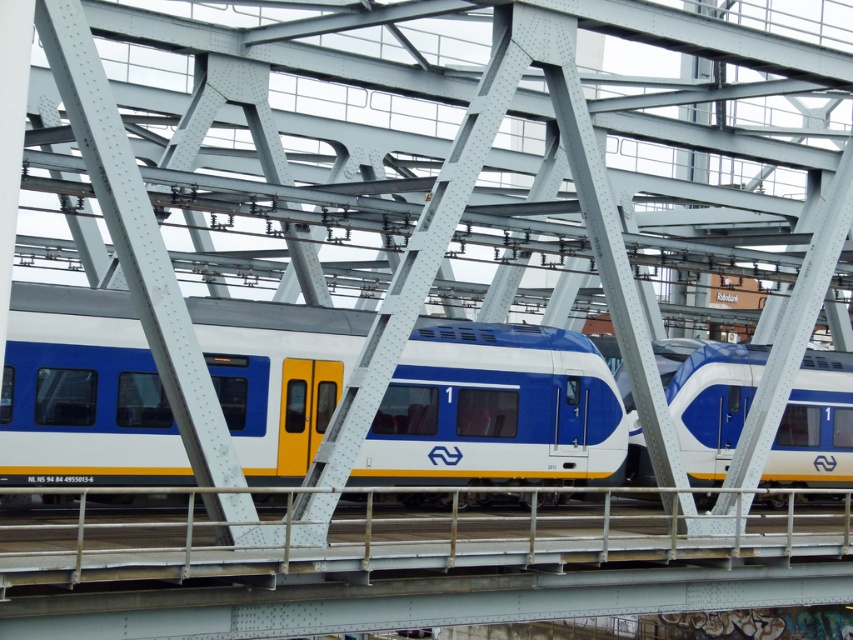
Which is more to the right, matte blue and white train at center or blue glossy train at center?

blue glossy train at center

How distant is matte blue and white train at center from blue glossy train at center?

matte blue and white train at center is 7.17 meters from blue glossy train at center.

Is point (231, 404) positioned before point (666, 349)?

Yes, it is.

Locate an element on the screen. This screenshot has width=853, height=640. matte blue and white train at center is located at coordinates (495, 410).